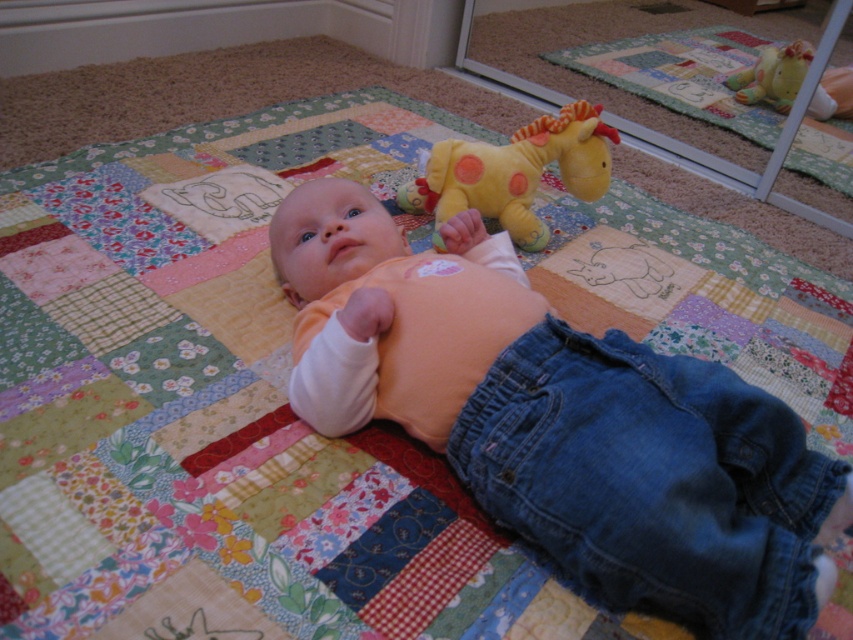
Question: Based on their relative distances, which object is farther from the matte orange shirt at center?

Choices:
 (A) yellow plush giraffe at upper center
 (B) soft yellow plush giraffe at upper center

Answer: (A)

Question: Which object is closer to the camera taking this photo?

Choices:
 (A) matte orange shirt at center
 (B) yellow plush giraffe at upper center

Answer: (A)

Question: Which object is positioned closest to the yellow plush giraffe at upper center?

Choices:
 (A) matte orange shirt at center
 (B) soft yellow plush giraffe at upper center

Answer: (B)

Question: Does matte orange shirt at center have a lesser width compared to soft yellow plush giraffe at upper center?

Choices:
 (A) no
 (B) yes

Answer: (A)

Question: Considering the relative positions of matte orange shirt at center and soft yellow plush giraffe at upper center in the image provided, where is matte orange shirt at center located with respect to soft yellow plush giraffe at upper center?

Choices:
 (A) left
 (B) right

Answer: (A)

Question: Does matte orange shirt at center lie behind yellow plush giraffe at upper center?

Choices:
 (A) no
 (B) yes

Answer: (A)